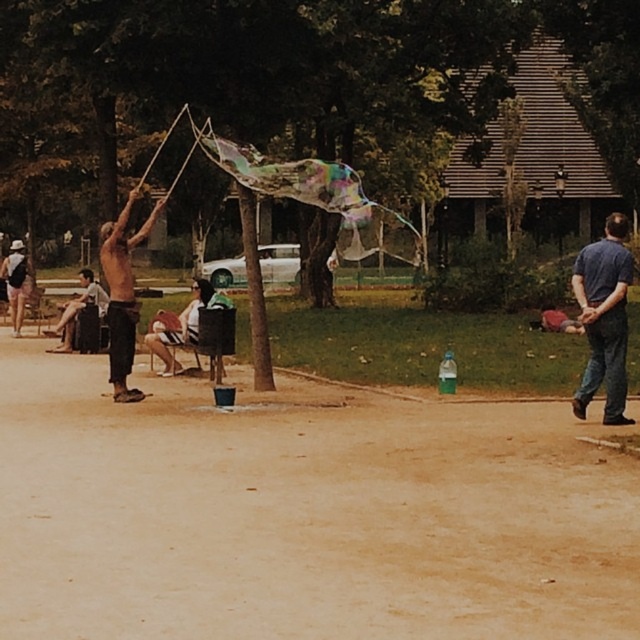
You are planning to set up a small tent in the brown dirt field at center. Considering the space occupied by the shiny black pants at left, will there be enough room for the tent?

The brown dirt field at center occupies less space than the shiny black pants at left, so there might not be enough room for the tent.

You are standing at the camera position and want to throw a frisbee to your friend wearing blue denim jeans at right. The frisbee can travel 15 meters. Will it reach them?

The blue denim jeans at right is 13.69 meters away from the camera, so yes, the frisbee can reach them since the distance is within the frisbee travel range.